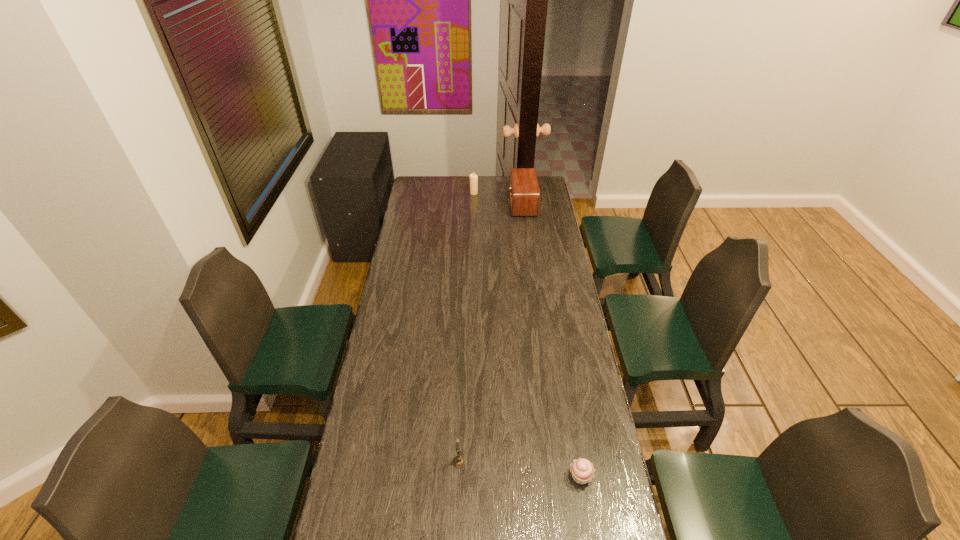
The height and width of the screenshot is (540, 960). What are the coordinates of `empty space that is in between the farther candle and the cupcake` in the screenshot? It's located at (527, 335).

This screenshot has width=960, height=540. I want to click on unoccupied position between the radio receiver and the cupcake, so click(552, 340).

Where is `free space between the farther candle and the cupcake`? The image size is (960, 540). free space between the farther candle and the cupcake is located at coordinates (527, 335).

Locate an element on the screen. The height and width of the screenshot is (540, 960). free space between the shortest object and the radio receiver is located at coordinates (552, 340).

Identify the location of free point between the radio receiver and the farther candle. (498, 198).

The width and height of the screenshot is (960, 540). Find the location of `free area in between the radio receiver and the farther candle`. free area in between the radio receiver and the farther candle is located at coordinates (498, 198).

Select which object is the closest to the farther candle. Please provide its 2D coordinates. Your answer should be formatted as a tuple, i.e. [(x, y)], where the tuple contains the x and y coordinates of a point satisfying the conditions above.

[(524, 193)]

Image resolution: width=960 pixels, height=540 pixels. I want to click on object that is the second closest to the radio receiver, so click(x=459, y=461).